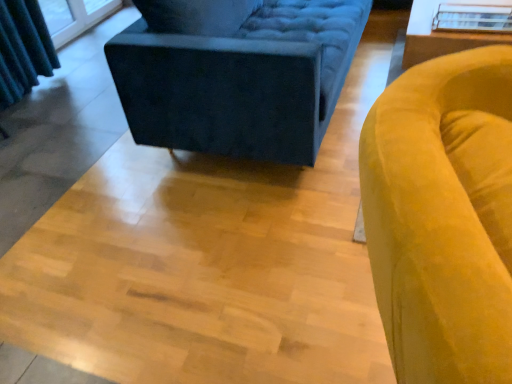
At what (x,y) coordinates should I click in order to perform the action: click on vacant space underneath transparent glass table at upper right (from a real-world perspective). Please return your answer as a coordinate pair (x, y). Image resolution: width=512 pixels, height=384 pixels. Looking at the image, I should click on (479, 23).